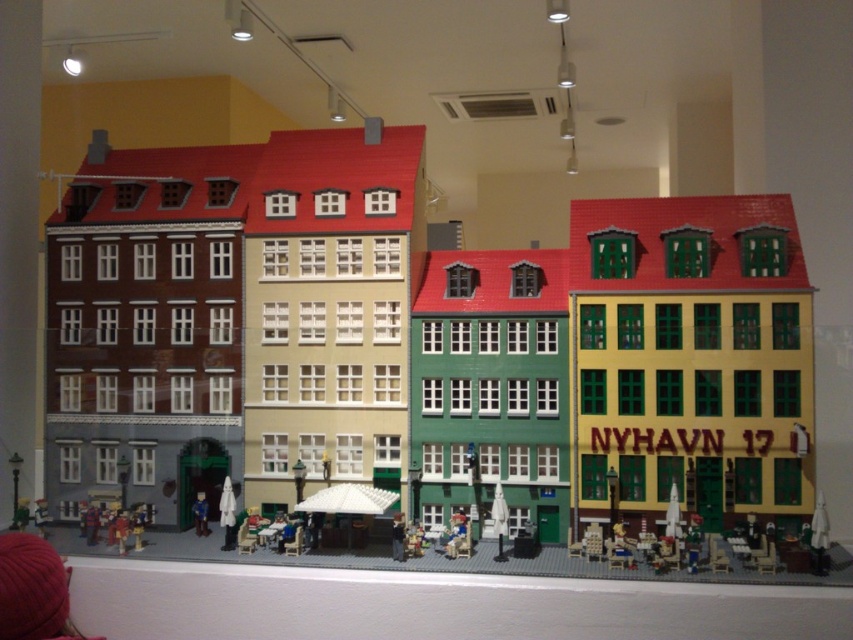
Question: Is smooth plastic chair at center above smooth plastic figure at center?

Choices:
 (A) no
 (B) yes

Answer: (A)

Question: Is smooth plastic chair at center wider than smooth plastic figure at center?

Choices:
 (A) no
 (B) yes

Answer: (B)

Question: Is smooth plastic chair at center wider than smooth plastic figure at center?

Choices:
 (A) no
 (B) yes

Answer: (B)